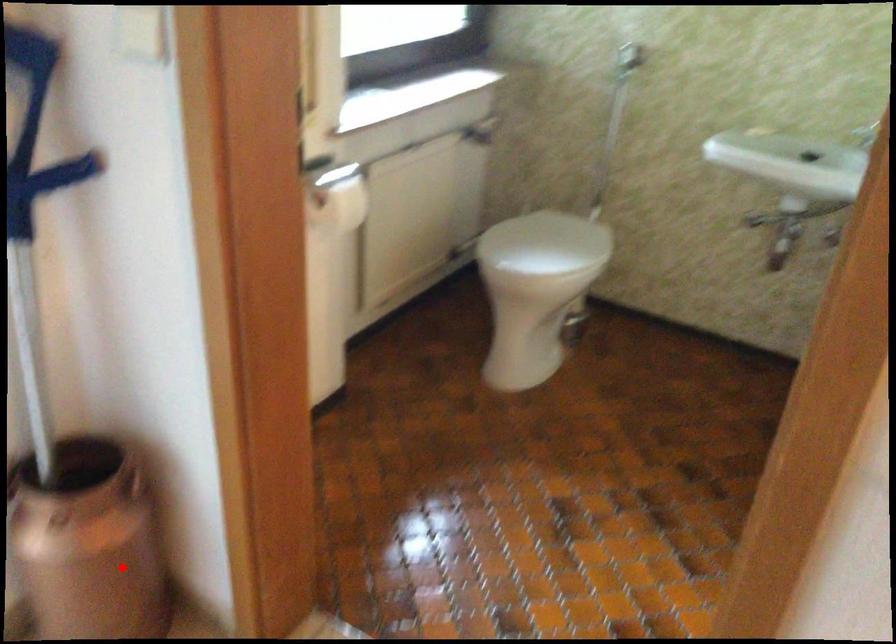
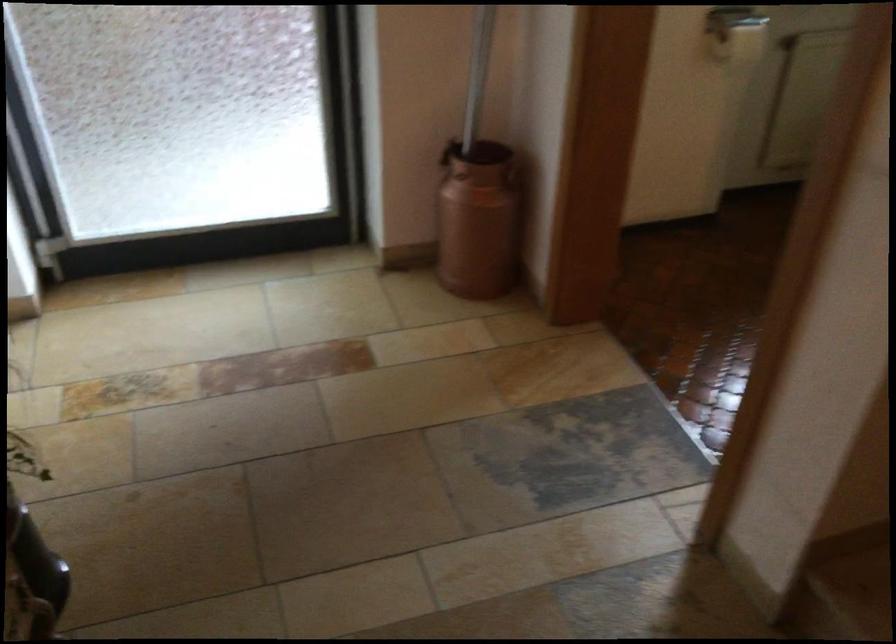
Question: I am providing you with two images of the same scene from different viewpoints. In image1, a red point is highlighted. Considering the same 3D point in image2, which of the following is correct?

Choices:
 (A) It is closer
 (B) It is farther

Answer: (B)